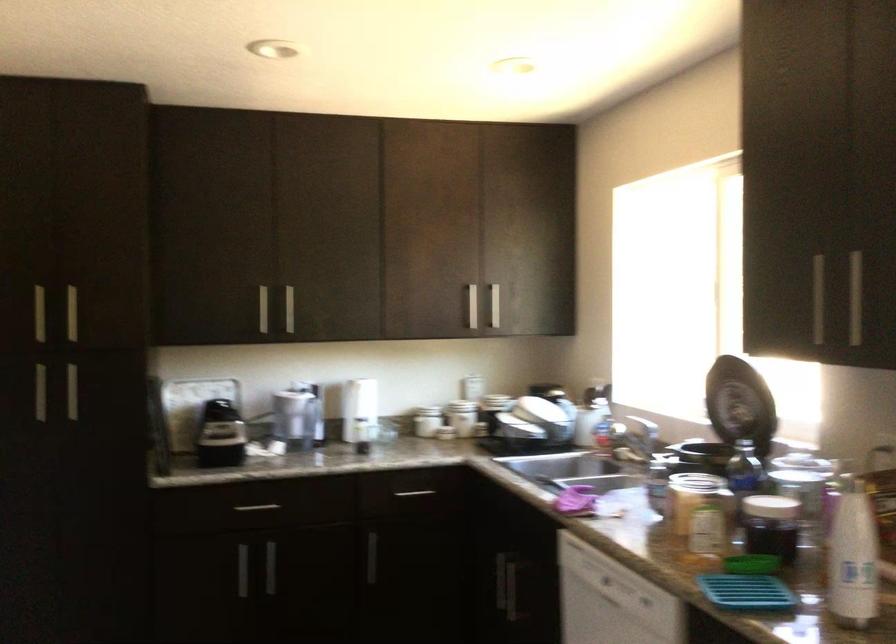
Where would you lift the white bottle? Please return your answer as a coordinate pair (x, y).

(426, 421)